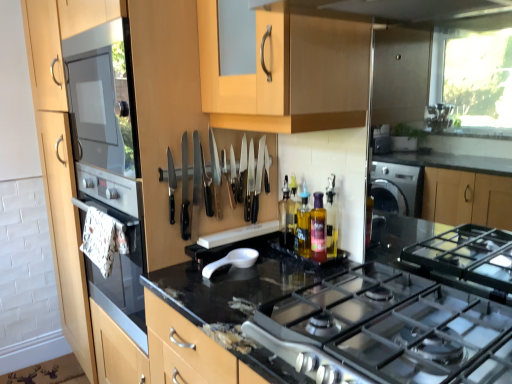
Find the location of a particular element. empty space that is to the right of white matte spoon at center is located at coordinates (278, 275).